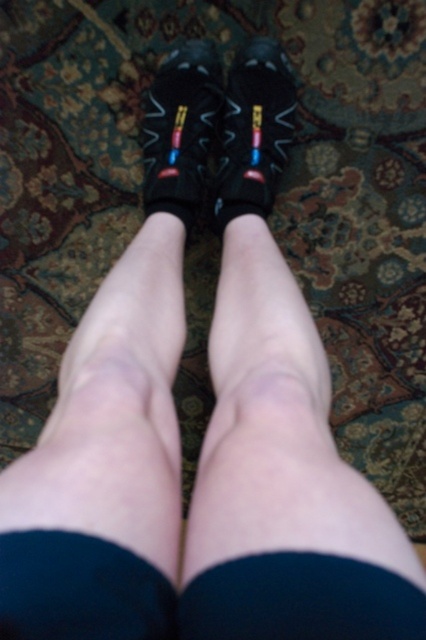
You are standing in a room with a patterned carpet. You see two points marked on the carpet at coordinates point (46, 566) and point (146, 198). If you are facing the same direction as the person in the image, which point is closer to you?

Point (46, 566) is in front of point (146, 198), so it is closer to you.

You are a fashion designer examining the image of a person wearing two black matte socks. The socks are labeled as black matte sock at center and black matte sock at lower center. Based on their positions, which sock is covering part of the other?

The black matte sock at center is positioned over the black matte sock at lower center, so the sock at center is covering part of the sock at lower center.

You are a photographer setting up a shoot in the scene described. You need to place a small prop between the black matte sock at center and the matte black slipper at center. Can you fit it vertically between them?

The black matte sock at center is below the matte black slipper at center, so there is vertical space between them. The prop can be placed vertically between the black matte sock at center and the matte black slipper at center.